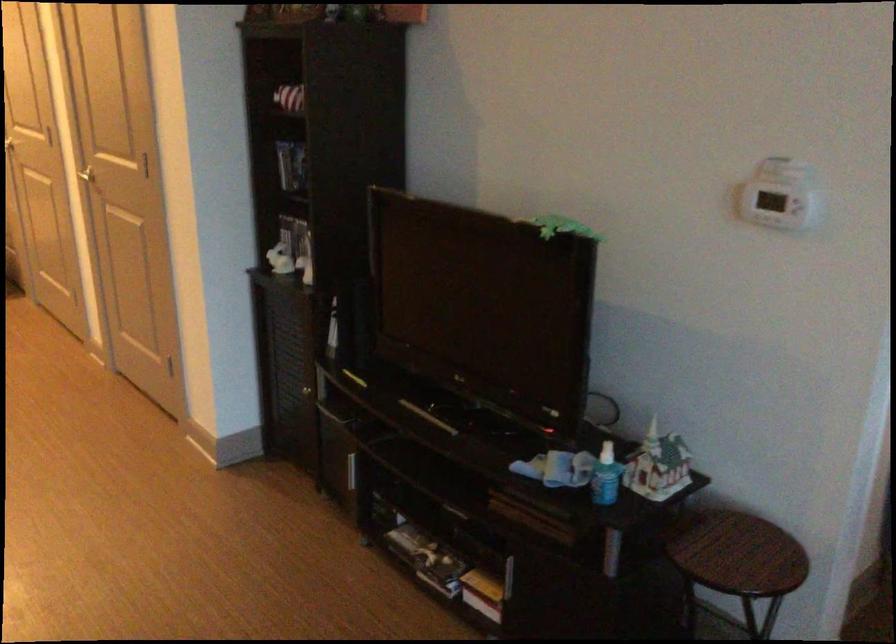
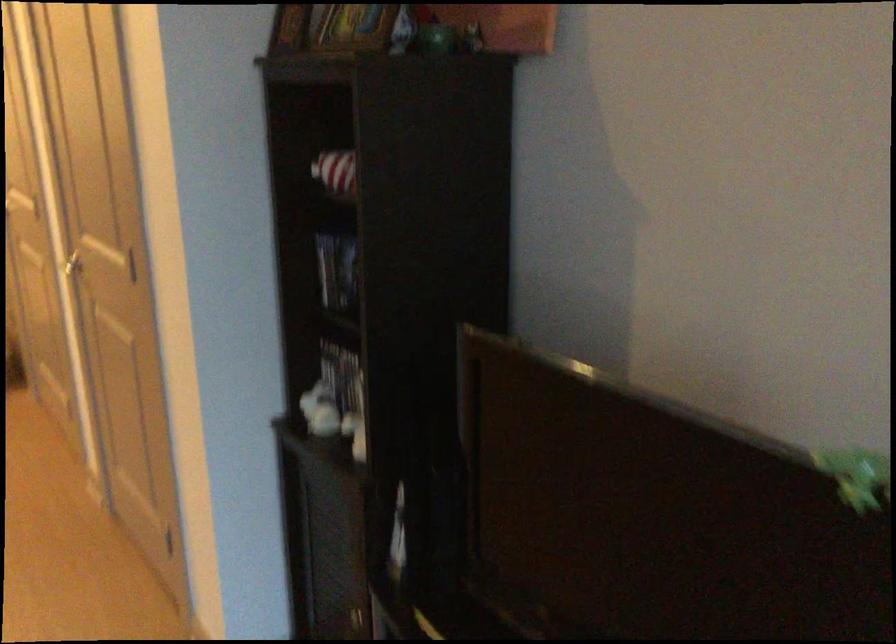
Locate, in the second image, the point that corresponds to the point at 288,261 in the first image.

(332, 418)